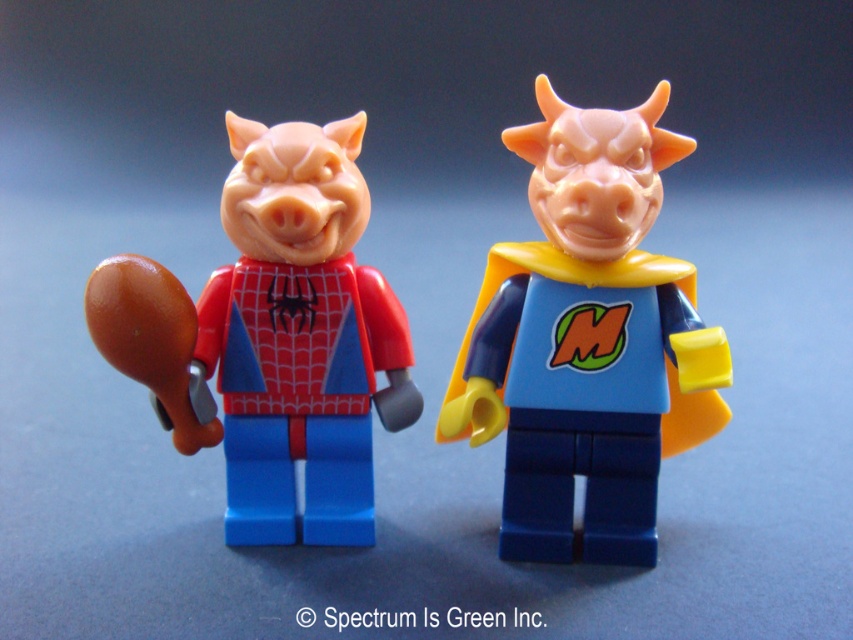
From the picture: Between matte plastic minifigure at right and matte plastic pig at center, which one is positioned higher?

matte plastic minifigure at right is higher up.

Which is in front, point (654, 355) or point (146, 294)?

Point (146, 294) is more forward.

In the scene shown: Who is more forward, (674,337) or (229,234)?

Point (674,337) is more forward.

The height and width of the screenshot is (640, 853). Identify the location of matte plastic minifigure at right. (585, 339).